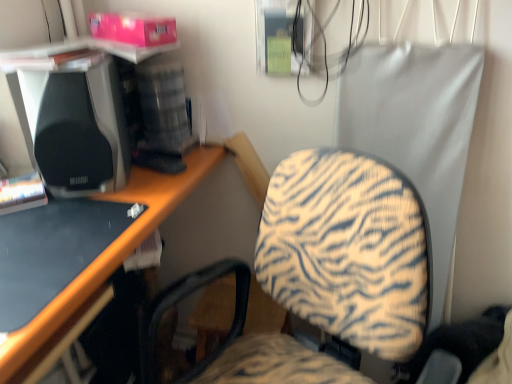
The height and width of the screenshot is (384, 512). Identify the location of free location above black glossy desk at lower left (from a real-world perspective). (48, 233).